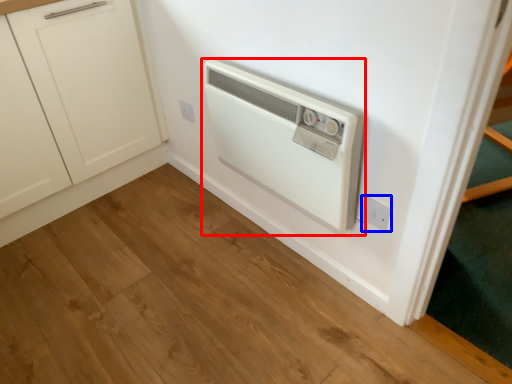
Question: Which object is closer to the camera taking this photo, home appliance (highlighted by a red box) or electric outlet (highlighted by a blue box)?

Choices:
 (A) home appliance
 (B) electric outlet

Answer: (A)